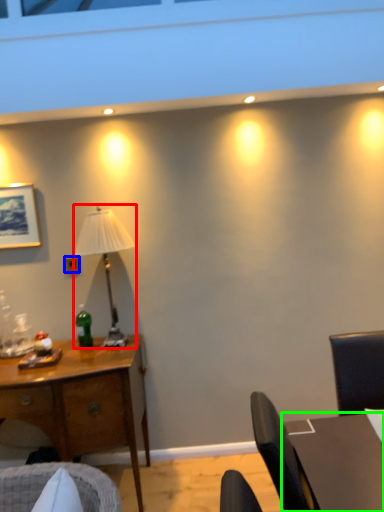
Question: Which is nearer to the lamp (highlighted by a red box)? power outlet (highlighted by a blue box) or table (highlighted by a green box).

Choices:
 (A) power outlet
 (B) table

Answer: (A)